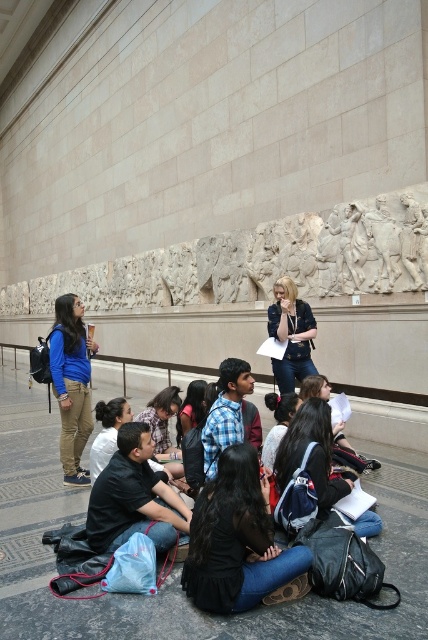
You are a visitor in the museum and want to take a photo of the white marble relief at upper center without blocking the view of others. Where should you position yourself relative to the matte blue shirt at lower left?

You should position yourself above the matte blue shirt at lower left to ensure a clear view of the white marble relief at upper center since the relief is located above the shirt.

You are a tour guide in the museum. You notice a visitor asking about the dimensions of the objects in the scene. Which object is wider, the matte blue shirt at lower left or the white marble relief at upper center?

The matte blue shirt at lower left is wider than the white marble relief at upper center according to the description.